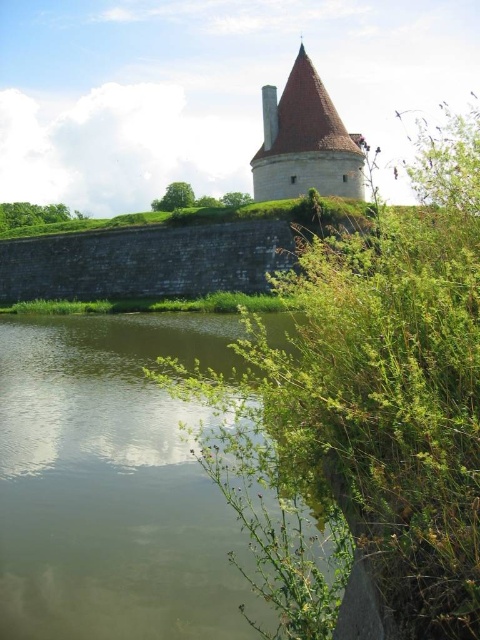
Which is more to the left, green grassy river at lower left or smooth beige stone tower at upper center?

From the viewer's perspective, green grassy river at lower left appears more on the left side.

Between point (63, 452) and point (302, 186), which one is positioned in front?

Point (63, 452) is in front.

At what (x,y) coordinates should I click in order to perform the action: click on green grassy river at lower left. Please return your answer as a coordinate pair (x, y). Looking at the image, I should click on (112, 484).